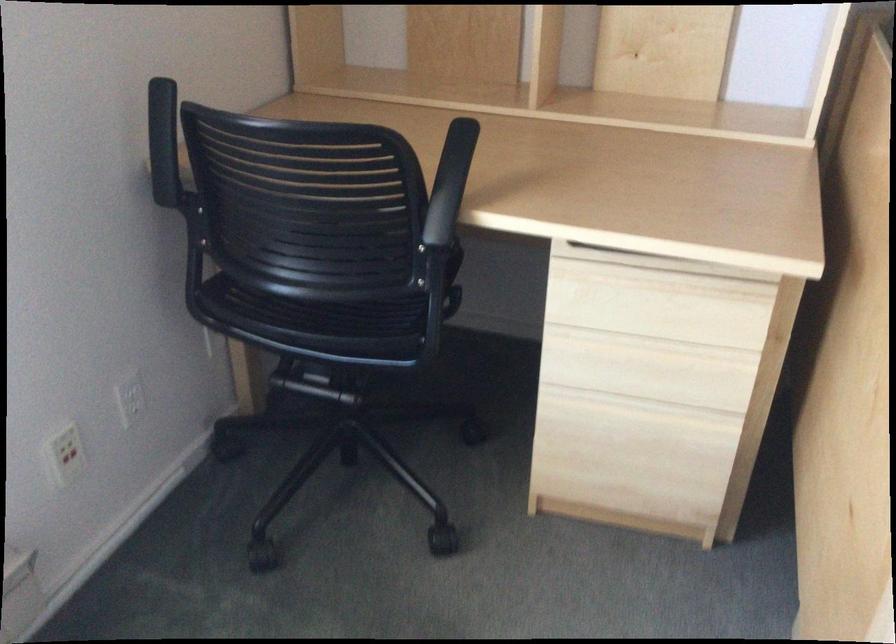
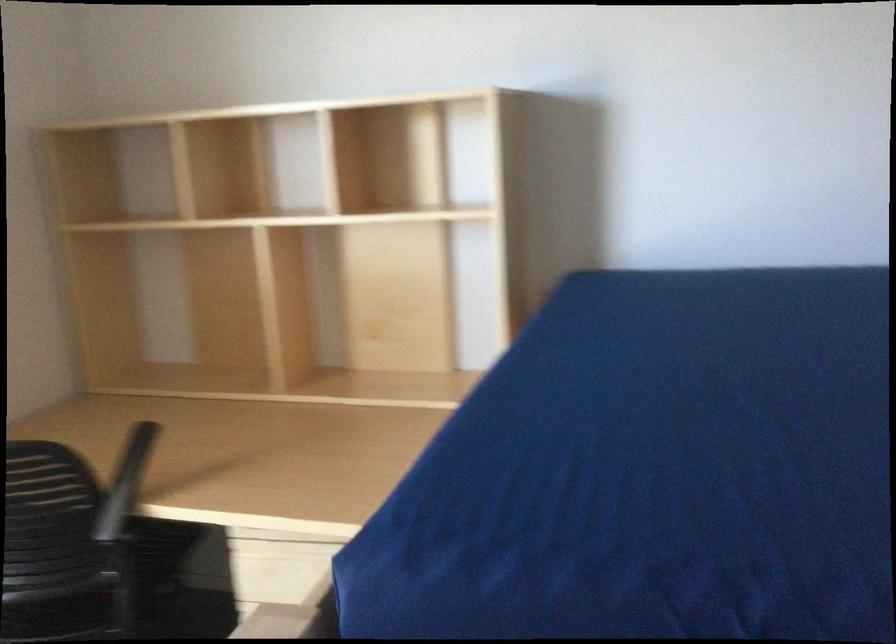
Question: Based on the continuous images, in which direction is the camera rotating? Reply with the corresponding letter.

Choices:
 (A) Left
 (B) Right
 (C) Up
 (D) Down

Answer: (C)